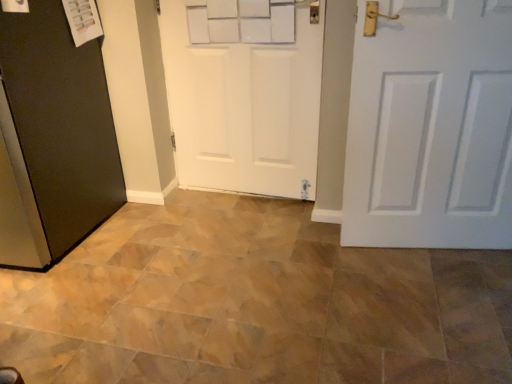
The image size is (512, 384). I want to click on free spot above brown ceramic tile at center (from a real-world perspective), so click(220, 267).